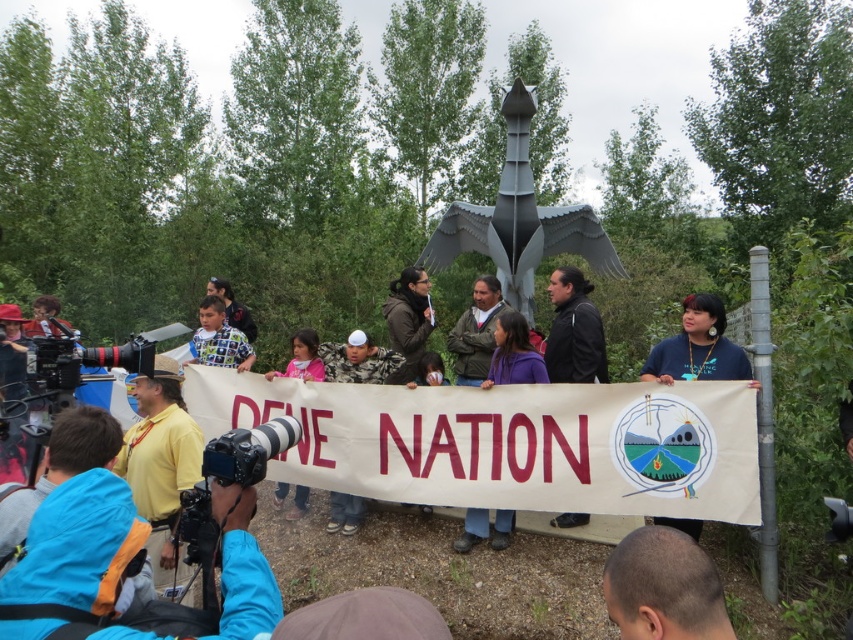
Question: Based on their relative distances, which object is farther from the yellow shirt at center?

Choices:
 (A) bald head at lower right
 (B) pink fabric shirt at center

Answer: (A)

Question: Among these objects, which one is nearest to the camera?

Choices:
 (A) yellow shirt at center
 (B) printed fabric shirt at center
 (C) bald head at lower right
 (D) pink fabric shirt at center

Answer: (C)

Question: Considering the relative positions of black leather jacket at center and pink fabric shirt at center in the image provided, where is black leather jacket at center located with respect to pink fabric shirt at center?

Choices:
 (A) right
 (B) left

Answer: (A)

Question: Is yellow shirt at center thinner than blue fabric shirt at center?

Choices:
 (A) yes
 (B) no

Answer: (B)

Question: Which object is closer to the camera taking this photo?

Choices:
 (A) yellow shirt at center
 (B) blue fabric shirt at center
 (C) bald head at lower right
 (D) black plastic video camera at lower left

Answer: (C)

Question: Is black leather jacket at center thinner than printed fabric shirt at center?

Choices:
 (A) no
 (B) yes

Answer: (B)